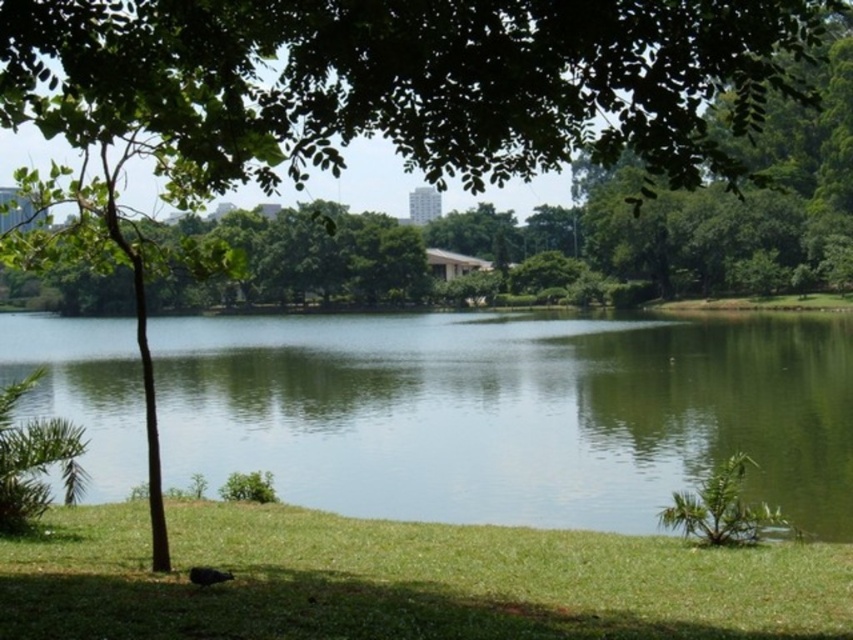
You are planning to set up a picnic blanket. The green smooth water at center and the green grass at lower left are both available areas. Which area is bigger and more suitable for placing a picnic blanket?

The green smooth water at center is larger in size than the green grass at lower left, so it is more suitable for placing a picnic blanket.

You are planning to place a small wooden bench in the lakeside scene. The bench requires a flat area that is wider than the green grass at lower left. Can the green smooth water at center provide a suitable location for placing the bench?

The green smooth water at center might be wider than the green grass at lower left, so it could potentially provide a suitable location for placing the bench if the width is sufficient.